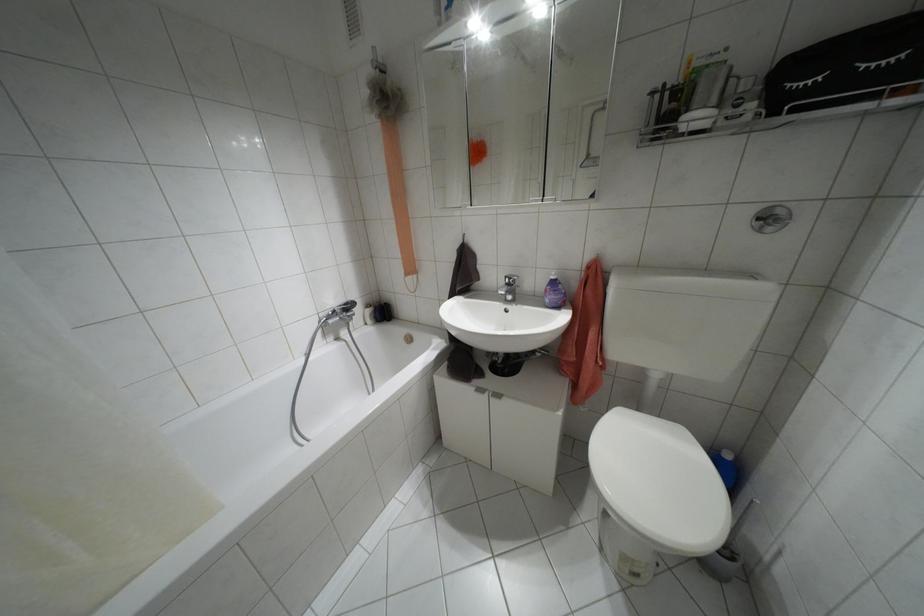
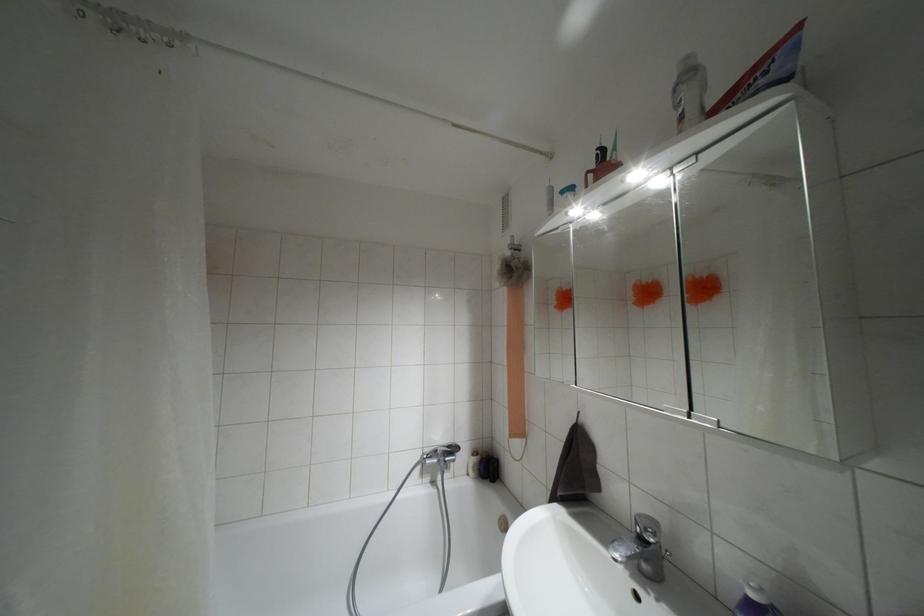
The point at (386, 108) is marked in the first image. Where is the corresponding point in the second image?

(509, 277)